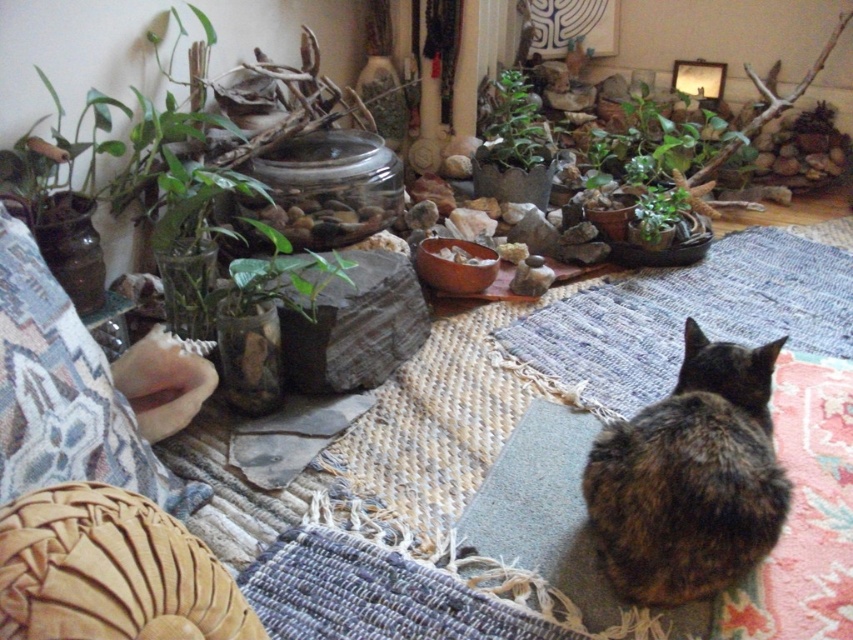
Does point (712, 376) lie in front of point (554, 333)?

That is True.

Is tortoiseshell fur cat at center thinner than blue woven mat at lower right?

Yes.

Which is behind, point (670, 410) or point (628, 369)?

The point (628, 369) is more distant.

You are a GUI agent. You are given a task and a screenshot of the screen. Output one action in this format:
    pyautogui.click(x=<x>, y=<y>)
    Task: Click on the tortoiseshell fur cat at center
    Image resolution: width=853 pixels, height=640 pixels.
    Given the screenshot: What is the action you would take?
    pyautogui.click(x=689, y=477)

This screenshot has width=853, height=640. What do you see at coordinates (85, 392) in the screenshot?
I see `woven fabric pillow at lower left` at bounding box center [85, 392].

Is woven fabric pillow at lower left wider than green glossy plant at upper center?

Indeed, woven fabric pillow at lower left has a greater width compared to green glossy plant at upper center.

Who is more forward, (57, 336) or (500, 115)?

Point (57, 336) is in front.

Find the location of a particular element. woven fabric pillow at lower left is located at coordinates (85, 392).

Is green glossy plant at upper center positioned at the back of green leafy plant at center?

Yes.

Between point (531, 99) and point (647, 198), which one is positioned behind?

The point (531, 99) is behind.

Identify the location of green glossy plant at upper center. (512, 122).